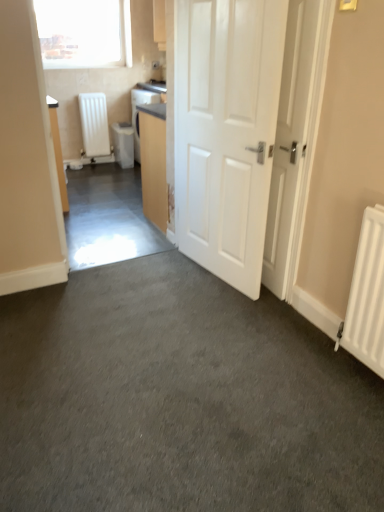
This screenshot has width=384, height=512. In order to click on free spot in front of matte wood cabinet at center in this screenshot , I will do `click(144, 239)`.